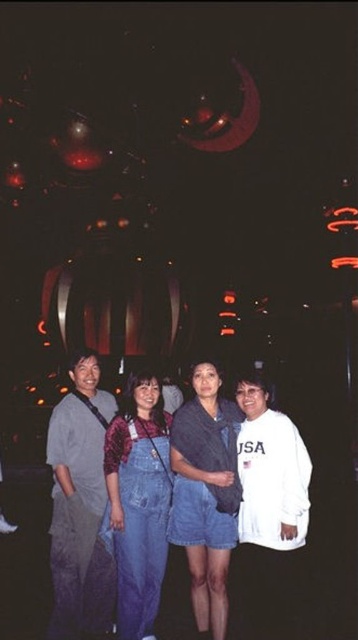
Question: Which is farther from the denim skirt at center?

Choices:
 (A) gray cotton shirt at left
 (B) denim overalls at center

Answer: (A)

Question: Which point is closer to the camera?

Choices:
 (A) (292, 620)
 (B) (153, 618)

Answer: (A)

Question: Which point appears farthest from the camera in this image?

Choices:
 (A) click(131, 420)
 (B) click(224, 513)
 (C) click(84, 577)

Answer: (A)

Question: Does gray cotton shirt at left appear on the right side of white matte sweatshirt at lower right?

Choices:
 (A) no
 (B) yes

Answer: (A)

Question: Observing the image, what is the correct spatial positioning of white matte sweatshirt at lower right in reference to denim skirt at center?

Choices:
 (A) above
 (B) below

Answer: (B)

Question: Is white matte sweatshirt at lower right closer to camera compared to denim overalls at center?

Choices:
 (A) no
 (B) yes

Answer: (B)